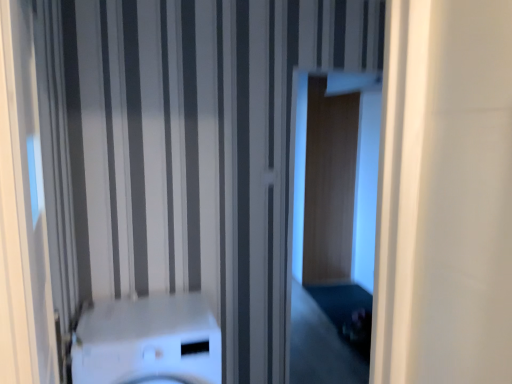
Question: From the image's perspective, relative to white glossy washer at center, is transparent glass door at center above or below?

Choices:
 (A) below
 (B) above

Answer: (B)

Question: Looking at their shapes, would you say transparent glass door at center is wider or thinner than white glossy washer at center?

Choices:
 (A) thin
 (B) wide

Answer: (A)

Question: From their relative heights in the image, would you say transparent glass door at center is taller or shorter than white glossy washer at center?

Choices:
 (A) tall
 (B) short

Answer: (A)

Question: From the image's perspective, relative to transparent glass door at center, is white glossy washer at center above or below?

Choices:
 (A) above
 (B) below

Answer: (B)

Question: In the image, is white glossy washer at center on the left side or the right side of transparent glass door at center?

Choices:
 (A) right
 (B) left

Answer: (B)

Question: Considering the positions of point (217, 354) and point (350, 380), is point (217, 354) closer or farther from the camera than point (350, 380)?

Choices:
 (A) closer
 (B) farther

Answer: (A)

Question: Is white glossy washer at center situated inside transparent glass door at center or outside?

Choices:
 (A) outside
 (B) inside

Answer: (A)